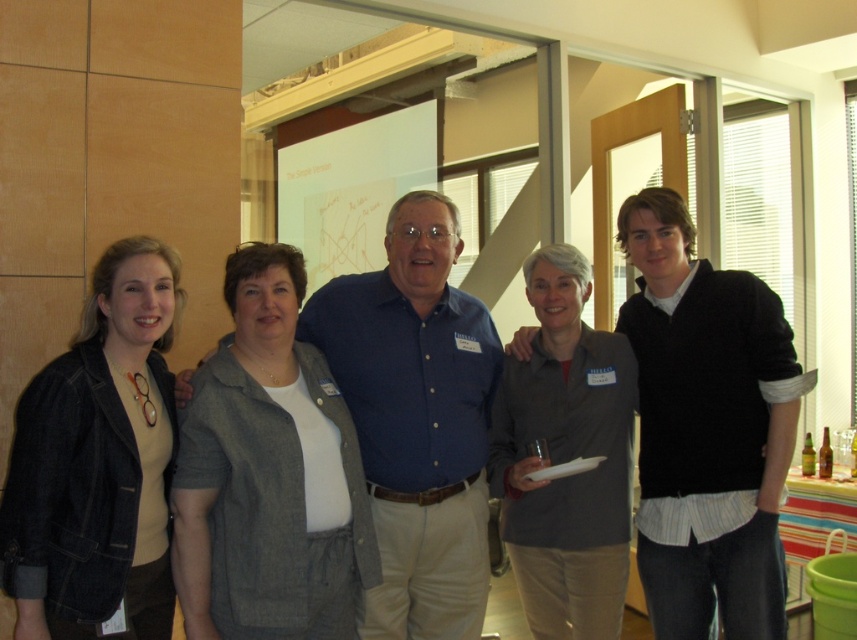
Can you confirm if gray fabric shirt at center is positioned to the left of denim jacket at left?

Incorrect, gray fabric shirt at center is not on the left side of denim jacket at left.

Does gray fabric shirt at center appear under denim jacket at left?

No, gray fabric shirt at center is not below denim jacket at left.

Is point (652, 308) more distant than point (63, 362)?

That is True.

Locate an element on the screen. This screenshot has height=640, width=857. gray fabric shirt at center is located at coordinates (706, 428).

Is denim jacket at left thinner than gray matte shirt at center?

Yes.

Is denim jacket at left below gray matte shirt at center?

Incorrect, denim jacket at left is not positioned below gray matte shirt at center.

Is point (100, 579) closer to viewer compared to point (537, 588)?

Yes, point (100, 579) is closer to viewer.

At what (x,y) coordinates should I click in order to perform the action: click on denim jacket at left. Please return your answer as a coordinate pair (x, y). Image resolution: width=857 pixels, height=640 pixels. Looking at the image, I should click on (99, 461).

How distant is gray fabric shirt at center from gray matte shirt at center?

gray fabric shirt at center and gray matte shirt at center are 9.55 inches apart from each other.

You are a GUI agent. You are given a task and a screenshot of the screen. Output one action in this format:
    pyautogui.click(x=<x>, y=<y>)
    Task: Click on the gray fabric shirt at center
    This screenshot has height=640, width=857.
    Given the screenshot: What is the action you would take?
    pyautogui.click(x=706, y=428)

Where is `gray fabric shirt at center`? The height and width of the screenshot is (640, 857). gray fabric shirt at center is located at coordinates tap(706, 428).